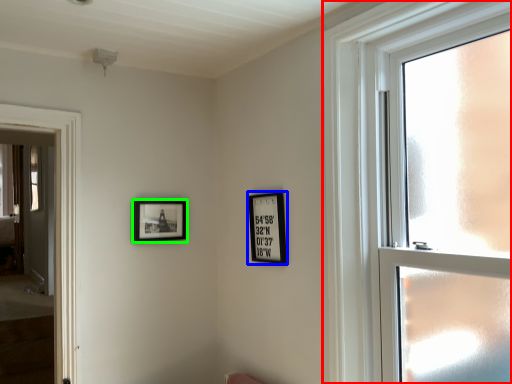
Question: Which object is positioned farthest from window (highlighted by a red box)? Select from picture frame (highlighted by a blue box) and picture frame (highlighted by a green box).

Choices:
 (A) picture frame
 (B) picture frame

Answer: (B)